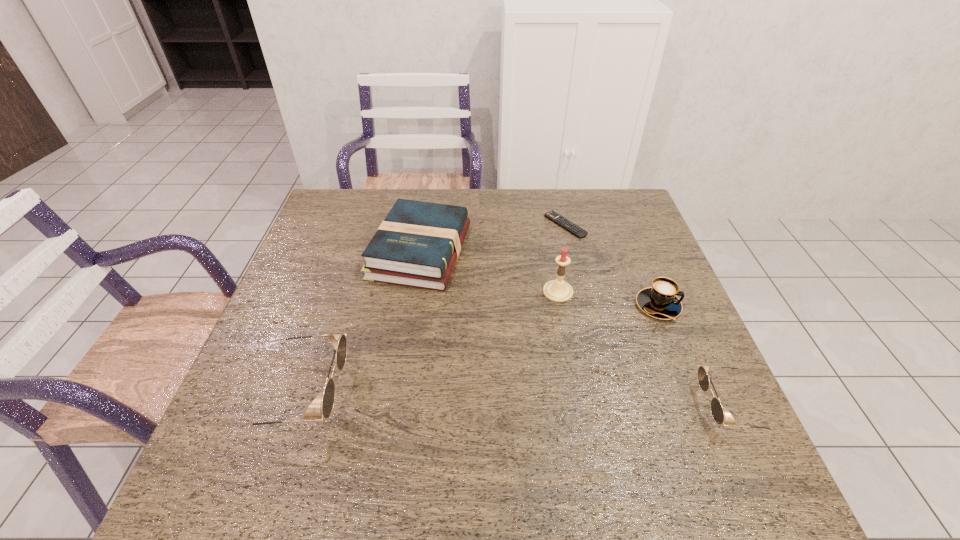
This screenshot has height=540, width=960. In order to click on the taller sunglasses in this screenshot , I will do `click(339, 341)`.

Find the location of a particular element. This screenshot has width=960, height=540. the fifth shortest object is located at coordinates (339, 341).

The image size is (960, 540). What are the coordinates of `the right sunglasses` in the screenshot? It's located at (716, 408).

Find the location of a particular element. Image resolution: width=960 pixels, height=540 pixels. candle is located at coordinates (557, 290).

At what (x,y) coordinates should I click in order to perform the action: click on hardback book. Please return your answer as a coordinate pair (x, y). The width and height of the screenshot is (960, 540). Looking at the image, I should click on (418, 243).

This screenshot has height=540, width=960. What are the coordinates of `cappuccino` in the screenshot? It's located at (660, 301).

Locate an element on the screen. the shortest object is located at coordinates pos(564,223).

This screenshot has width=960, height=540. What are the coordinates of `vacant area located 0.100m on the front lenses of the fifth shortest object` in the screenshot? It's located at (390, 393).

Locate an element on the screen. The height and width of the screenshot is (540, 960). free space located 0.080m on the front lenses of the shorter sunglasses is located at coordinates (664, 406).

The width and height of the screenshot is (960, 540). I want to click on free space located on the front lenses of the shorter sunglasses, so click(516, 406).